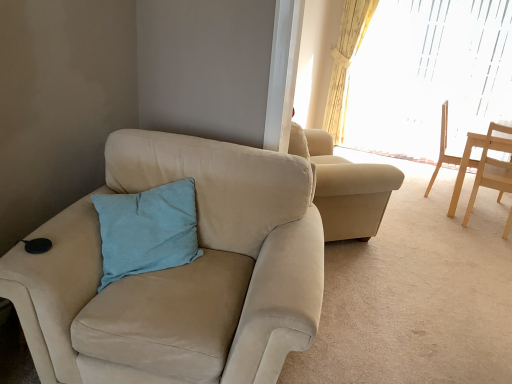
Measure the distance between point (153, 306) and camera.

The depth of point (153, 306) is 4.92 feet.

You are a GUI agent. You are given a task and a screenshot of the screen. Output one action in this format:
    pyautogui.click(x=<x>, y=<y>)
    Task: Click on the suede beige chair at left, arranged as the 1th chair when viewed from the left
    The height and width of the screenshot is (384, 512).
    Given the screenshot: What is the action you would take?
    pyautogui.click(x=179, y=273)

What is the approximate width of light blue fabric pillow at center?

It is 35.31 centimeters.

The width and height of the screenshot is (512, 384). What do you see at coordinates (345, 62) in the screenshot?
I see `yellow floral fabric curtain at upper right` at bounding box center [345, 62].

Find the location of a particular element. The height and width of the screenshot is (384, 512). suede beige chair at left, arranged as the 1th chair when viewed from the left is located at coordinates (179, 273).

Could you tell me if yellow floral fabric curtain at upper right is facing translucent glass window at upper right?

No, yellow floral fabric curtain at upper right is not oriented towards translucent glass window at upper right.

Is yellow floral fabric curtain at upper right inside or outside of translucent glass window at upper right?

yellow floral fabric curtain at upper right is outside translucent glass window at upper right.

Considering the relative sizes of yellow floral fabric curtain at upper right and translucent glass window at upper right in the image provided, is yellow floral fabric curtain at upper right smaller than translucent glass window at upper right?

Correct, yellow floral fabric curtain at upper right occupies less space than translucent glass window at upper right.

From the image's perspective, which is above, yellow floral fabric curtain at upper right or translucent glass window at upper right?

yellow floral fabric curtain at upper right, from the image's perspective.

Is point (462, 173) less distant than point (249, 303)?

No, (462, 173) is further to viewer.

Who is shorter, light brown wooden chair at right, which is counted as the 1th chair, starting from the back, or suede beige chair at left, acting as the 1th chair starting from the front?

With less height is suede beige chair at left, acting as the 1th chair starting from the front.

Considering the positions of objects light brown wooden chair at right, which is counted as the 1th chair, starting from the back, and suede beige chair at left, arranged as the 1th chair when viewed from the left, in the image provided, who is in front, light brown wooden chair at right, which is counted as the 1th chair, starting from the back, or suede beige chair at left, arranged as the 1th chair when viewed from the left,?

suede beige chair at left, arranged as the 1th chair when viewed from the left, is more forward.

Is light brown wooden chair at right, which is counted as the 1th chair, starting from the back, inside the boundaries of suede beige chair at left, arranged as the 1th chair when viewed from the left, or outside?

light brown wooden chair at right, which is counted as the 1th chair, starting from the back, exists outside the volume of suede beige chair at left, arranged as the 1th chair when viewed from the left.

In terms of height, does light wood chair at right, which is the second chair from back to front, look taller or shorter compared to light brown wooden chair at right, placed as the second chair when sorted from left to right?

light wood chair at right, which is the second chair from back to front, is shorter than light brown wooden chair at right, placed as the second chair when sorted from left to right.

Can you confirm if light wood chair at right, which is counted as the 3th chair, starting from the left, is positioned to the right of light brown wooden chair at right, the 3th chair from the front?

Yes, light wood chair at right, which is counted as the 3th chair, starting from the left, is to the right of light brown wooden chair at right, the 3th chair from the front.

How distant is light wood chair at right, which appears as the 1th chair when viewed from the right, from light brown wooden chair at right, the 3th chair from the front?

They are 8.53 inches apart.

Is light wood chair at right, which is counted as the 3th chair, starting from the left, facing away from light brown wooden chair at right, the 3th chair from the front?

No, light wood chair at right, which is counted as the 3th chair, starting from the left,'s orientation is not away from light brown wooden chair at right, the 3th chair from the front.

From a real-world perspective, does yellow floral fabric curtain at upper right stand above suede beige chair at left, acting as the 1th chair starting from the front?

Correct, in the physical world, yellow floral fabric curtain at upper right is higher than suede beige chair at left, acting as the 1th chair starting from the front.

In terms of height, does yellow floral fabric curtain at upper right look taller or shorter compared to suede beige chair at left, arranged as the 1th chair when viewed from the left?

In the image, yellow floral fabric curtain at upper right appears to be taller than suede beige chair at left, arranged as the 1th chair when viewed from the left.

From the image's perspective, relative to suede beige chair at left, acting as the third chair starting from the back, is yellow floral fabric curtain at upper right above or below?

yellow floral fabric curtain at upper right is situated higher than suede beige chair at left, acting as the third chair starting from the back, in the image.

Is yellow floral fabric curtain at upper right bigger than suede beige chair at left, acting as the third chair starting from the back?

No, yellow floral fabric curtain at upper right is not bigger than suede beige chair at left, acting as the third chair starting from the back.

The height and width of the screenshot is (384, 512). Identify the location of window above the light wood chair at right, which is the second chair from back to front (from the image's perspective). (429, 75).

Is light wood chair at right, which appears as the 1th chair when viewed from the right, outside of translucent glass window at upper right?

light wood chair at right, which appears as the 1th chair when viewed from the right, lies outside translucent glass window at upper right's area.

Which object is further away from the camera taking this photo, light wood chair at right, which is counted as the 3th chair, starting from the left, or translucent glass window at upper right?

translucent glass window at upper right is further away from the camera.

In terms of height, does light wood chair at right, which is the 2th chair from front to back, look taller or shorter compared to translucent glass window at upper right?

In the image, light wood chair at right, which is the 2th chair from front to back, appears to be shorter than translucent glass window at upper right.

Is light blue fabric pillow at center located within suede beige chair at left, acting as the 1th chair starting from the front?

Yes, suede beige chair at left, acting as the 1th chair starting from the front, is surrounding light blue fabric pillow at center.

Between suede beige chair at left, arranged as the 1th chair when viewed from the left, and light blue fabric pillow at center, which one has smaller size?

light blue fabric pillow at center.

From a real-world perspective, who is located higher, suede beige chair at left, arranged as the 1th chair when viewed from the left, or light blue fabric pillow at center?

light blue fabric pillow at center, from a real-world perspective.

You are a GUI agent. You are given a task and a screenshot of the screen. Output one action in this format:
    pyautogui.click(x=<x>, y=<y>)
    Task: Click on the pillow to the left of suede beige chair at left, the third chair in the right-to-left sequence
    This screenshot has height=384, width=512.
    Given the screenshot: What is the action you would take?
    pyautogui.click(x=147, y=230)

Is light brown wooden chair at right, placed as the second chair when sorted from left to right, situated inside light blue fabric pillow at center or outside?

light brown wooden chair at right, placed as the second chair when sorted from left to right, is outside light blue fabric pillow at center.

Does light brown wooden chair at right, which is the second chair from right to left, touch light blue fabric pillow at center?

light brown wooden chair at right, which is the second chair from right to left, is not next to light blue fabric pillow at center, and they're not touching.

Considering the sizes of objects light brown wooden chair at right, placed as the second chair when sorted from left to right, and light blue fabric pillow at center in the image provided, who is bigger, light brown wooden chair at right, placed as the second chair when sorted from left to right, or light blue fabric pillow at center?

light brown wooden chair at right, placed as the second chair when sorted from left to right, is bigger.

Find the location of `curtain on the left of translucent glass window at upper right`. curtain on the left of translucent glass window at upper right is located at coordinates (345, 62).

Where is `chair that is the 2nd object above the light brown wooden chair at right, the 3th chair from the front (from a real-world perspective)`? The height and width of the screenshot is (384, 512). chair that is the 2nd object above the light brown wooden chair at right, the 3th chair from the front (from a real-world perspective) is located at coordinates (x=179, y=273).

Estimate the real-world distances between objects in this image. Which object is further from yellow floral fabric curtain at upper right, light blue fabric pillow at center or light wood chair at right, which appears as the 1th chair when viewed from the right?

Based on the image, light blue fabric pillow at center appears to be further to yellow floral fabric curtain at upper right.

Looking at the image, which one is located closer to yellow floral fabric curtain at upper right, translucent glass window at upper right or light brown wooden chair at right, which is counted as the 1th chair, starting from the back?

translucent glass window at upper right is positioned closer to the anchor yellow floral fabric curtain at upper right.

Which object lies further to the anchor point yellow floral fabric curtain at upper right, light blue fabric pillow at center or translucent glass window at upper right?

Among the two, light blue fabric pillow at center is located further to yellow floral fabric curtain at upper right.

Estimate the real-world distances between objects in this image. Which object is closer to light blue fabric pillow at center, light wood chair at right, which is the second chair from back to front, or yellow floral fabric curtain at upper right?

The object closer to light blue fabric pillow at center is light wood chair at right, which is the second chair from back to front.

Estimate the real-world distances between objects in this image. Which object is closer to suede beige chair at left, acting as the third chair starting from the back, light wood chair at right, which is the 2th chair from front to back, or yellow floral fabric curtain at upper right?

A: The object closer to suede beige chair at left, acting as the third chair starting from the back, is light wood chair at right, which is the 2th chair from front to back.

Looking at the image, which one is located further to suede beige chair at left, acting as the third chair starting from the back, light blue fabric pillow at center or light brown wooden chair at right, which is counted as the 1th chair, starting from the back?

Based on the image, light brown wooden chair at right, which is counted as the 1th chair, starting from the back, appears to be further to suede beige chair at left, acting as the third chair starting from the back.

From the image, which object appears to be farther from translucent glass window at upper right, light blue fabric pillow at center or suede beige chair at left, acting as the third chair starting from the back?

Based on the image, light blue fabric pillow at center appears to be further to translucent glass window at upper right.

Looking at the image, which one is located further to light blue fabric pillow at center, light brown wooden chair at right, the 3th chair from the front, or suede beige chair at left, the third chair in the right-to-left sequence?

Among the two, light brown wooden chair at right, the 3th chair from the front, is located further to light blue fabric pillow at center.

The width and height of the screenshot is (512, 384). I want to click on window located between light blue fabric pillow at center and yellow floral fabric curtain at upper right in the depth direction, so click(429, 75).

Where is `pillow between suede beige chair at left, the third chair in the right-to-left sequence, and yellow floral fabric curtain at upper right from front to back`? pillow between suede beige chair at left, the third chair in the right-to-left sequence, and yellow floral fabric curtain at upper right from front to back is located at coordinates (147, 230).

Where is `chair situated between suede beige chair at left, acting as the 1th chair starting from the front, and light wood chair at right, which is the second chair from back to front, from left to right`? The height and width of the screenshot is (384, 512). chair situated between suede beige chair at left, acting as the 1th chair starting from the front, and light wood chair at right, which is the second chair from back to front, from left to right is located at coordinates (455, 158).

At what (x,y) coordinates should I click in order to perform the action: click on pillow between suede beige chair at left, arranged as the 1th chair when viewed from the left, and translucent glass window at upper right in the front-back direction. Please return your answer as a coordinate pair (x, y). The height and width of the screenshot is (384, 512). Looking at the image, I should click on (147, 230).